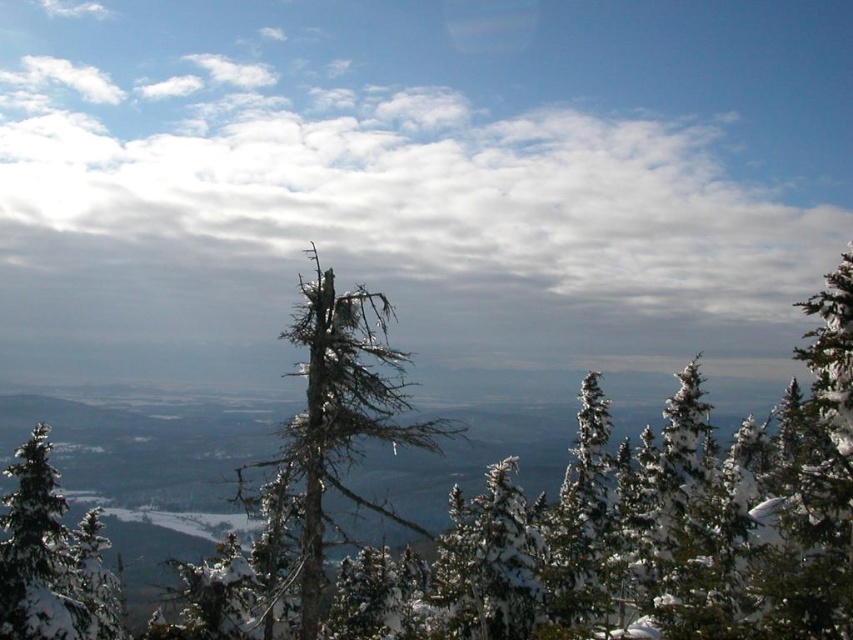
Is snow-covered tree at center wider than snow-covered bare tree at center?

Yes.

Is snow-covered tree at center bigger than snow-covered bare tree at center?

Correct, snow-covered tree at center is larger in size than snow-covered bare tree at center.

Identify the location of snow-covered tree at center. This screenshot has width=853, height=640. (549, 513).

You are a GUI agent. You are given a task and a screenshot of the screen. Output one action in this format:
    pyautogui.click(x=<x>, y=<y>)
    Task: Click on the snow-covered tree at center
    
    Given the screenshot: What is the action you would take?
    pyautogui.click(x=549, y=513)

Is white fluffy cloud at upper center taller than snow-covered bare tree at center?

Yes.

Which is below, white fluffy cloud at upper center or snow-covered bare tree at center?

Positioned lower is snow-covered bare tree at center.

Between point (445, 136) and point (376, 353), which one is positioned in front?

Positioned in front is point (376, 353).

This screenshot has width=853, height=640. What are the coordinates of `white fluffy cloud at upper center` in the screenshot? It's located at (430, 157).

Is point (293, 337) positioned behind point (76, 566)?

No, (293, 337) is in front of (76, 566).

Is point (328, 461) closer to viewer compared to point (109, 614)?

Yes, it is in front of point (109, 614).

Where is `snow-covered bare tree at center`? snow-covered bare tree at center is located at coordinates pos(335,422).